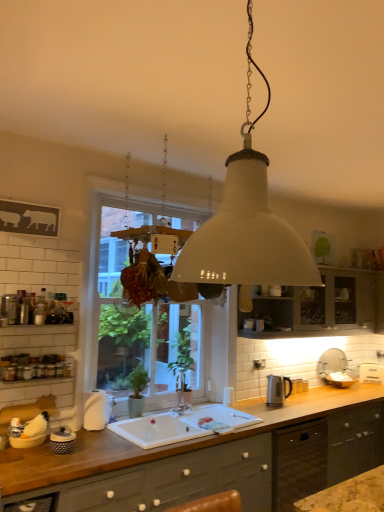
This screenshot has width=384, height=512. Find the location of `vacant space in front of matte black container at lower left, which is the first appliance from left to right`. vacant space in front of matte black container at lower left, which is the first appliance from left to right is located at coordinates (65, 459).